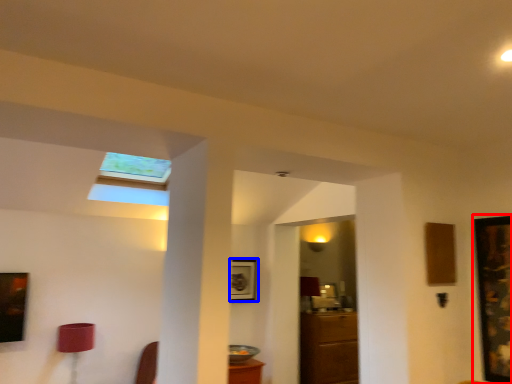
Question: Among these objects, which one is nearest to the camera, picture frame (highlighted by a red box) or picture frame (highlighted by a blue box)?

Choices:
 (A) picture frame
 (B) picture frame

Answer: (A)